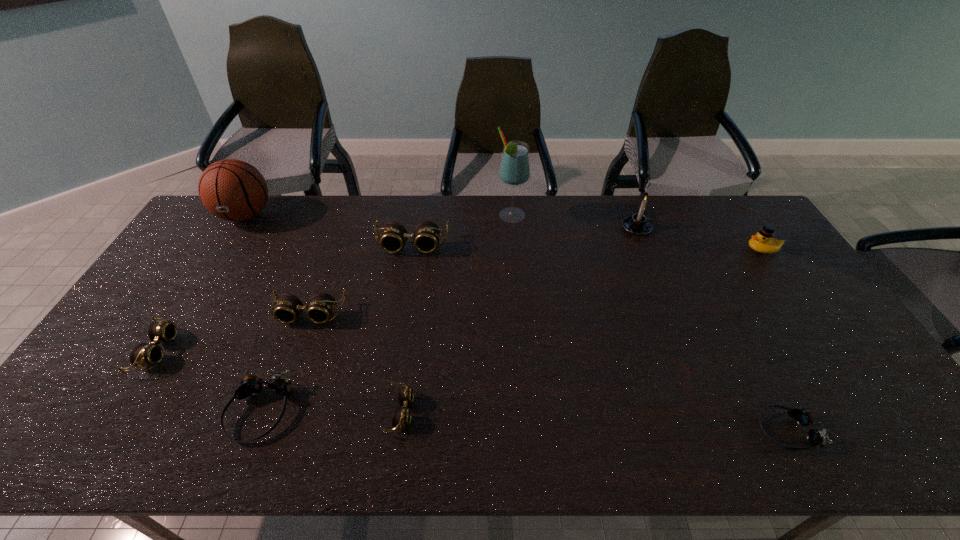
At what (x,y) coordinates should I click in order to perform the action: click on blank area located with a handle on the side of the eighth object from left to right. Please return your answer as a coordinate pair (x, y). The height and width of the screenshot is (540, 960). Looking at the image, I should click on point(665,228).

Identify the location of vacant space situated 0.270m through the lenses of the farthest brown goggles. Image resolution: width=960 pixels, height=540 pixels. pos(399,321).

This screenshot has height=540, width=960. In order to click on free space located on the front-facing side of the yellow duck in this screenshot , I will do `click(625, 249)`.

What are the coordinates of `free region located on the front-facing side of the yellow duck` in the screenshot? It's located at (635, 249).

The height and width of the screenshot is (540, 960). I want to click on vacant space situated 0.400m on the front-facing side of the yellow duck, so click(x=625, y=249).

You are a GUI agent. You are given a task and a screenshot of the screen. Output one action in this format:
    pyautogui.click(x=<x>, y=<y>)
    Task: Click on the free space located 0.240m through the lenses of the fifth shortest goggles
    Image resolution: width=960 pixels, height=540 pixels.
    Given the screenshot: What is the action you would take?
    pyautogui.click(x=277, y=405)

You are a GUI agent. You are given a task and a screenshot of the screen. Output one action in this format:
    pyautogui.click(x=<x>, y=<y>)
    Task: Click on the free space located 0.330m through the lenses of the leftmost brown goggles
    This screenshot has width=960, height=540.
    Given the screenshot: What is the action you would take?
    pyautogui.click(x=295, y=351)

The height and width of the screenshot is (540, 960). I want to click on vacant space located 0.080m through the lenses of the nearest brown goggles, so click(446, 411).

Where is `free space located 0.180m through the lenses of the ninth object from left to right`? This screenshot has height=540, width=960. free space located 0.180m through the lenses of the ninth object from left to right is located at coordinates (682, 430).

Identify the location of free location located through the lenses of the ninth object from left to right. (668, 430).